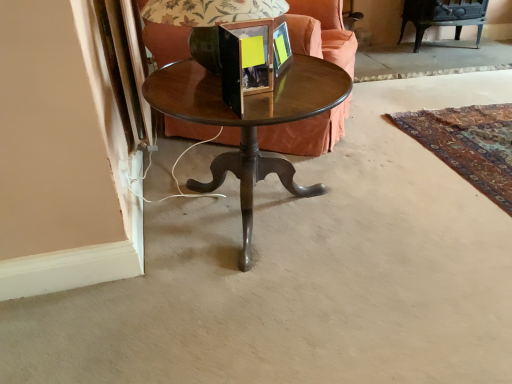
Identify the location of free space below wooden round table at center (from a real-world perspective). (259, 212).